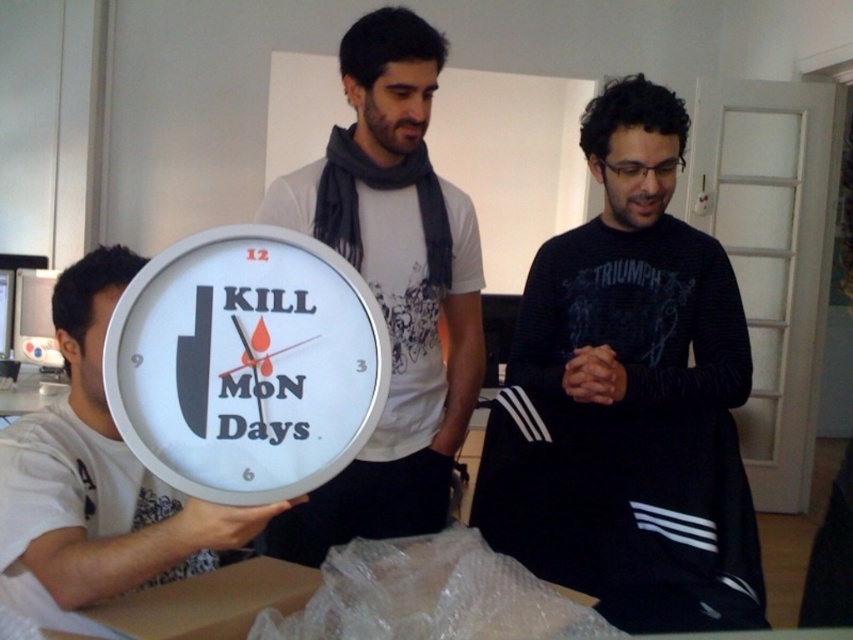
Question: Is black matte sweater at center smaller than brown cardboard box at lower left?

Choices:
 (A) no
 (B) yes

Answer: (A)

Question: Which point is farther from the camera taking this photo?

Choices:
 (A) (672, 156)
 (B) (86, 356)
 (C) (444, 227)
 (D) (181, 483)

Answer: (C)

Question: Does black matte sweater at center have a smaller size compared to white matte clock at center?

Choices:
 (A) no
 (B) yes

Answer: (A)

Question: Which object is closer to the camera taking this photo?

Choices:
 (A) white glossy clock at center
 (B) brown cardboard box at lower left
 (C) black matte sweater at center
 (D) white matte clock at left

Answer: (A)

Question: Is black matte sweater at center to the left of white matte clock at left from the viewer's perspective?

Choices:
 (A) yes
 (B) no

Answer: (B)

Question: Which point is closer to the camera taking this photo?

Choices:
 (A) (245, 540)
 (B) (260, 280)
 (C) (219, 636)
 (D) (415, 236)

Answer: (B)